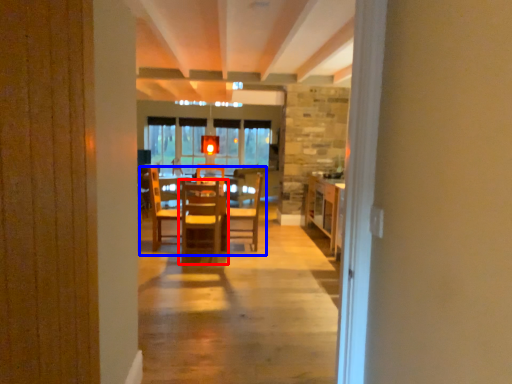
Question: Which object is further to the camera taking this photo, chair (highlighted by a red box) or table (highlighted by a blue box)?

Choices:
 (A) chair
 (B) table

Answer: (B)